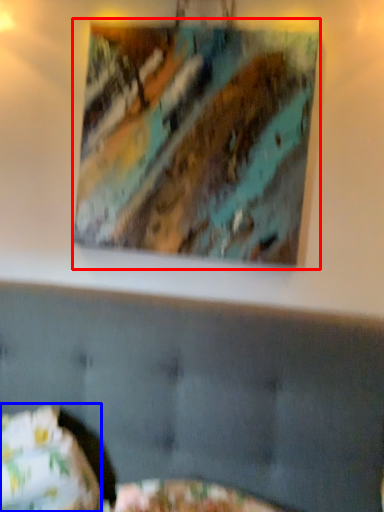
Question: Which point is closer to the camera, picture frame (highlighted by a red box) or pillow (highlighted by a blue box)?

Choices:
 (A) picture frame
 (B) pillow

Answer: (B)